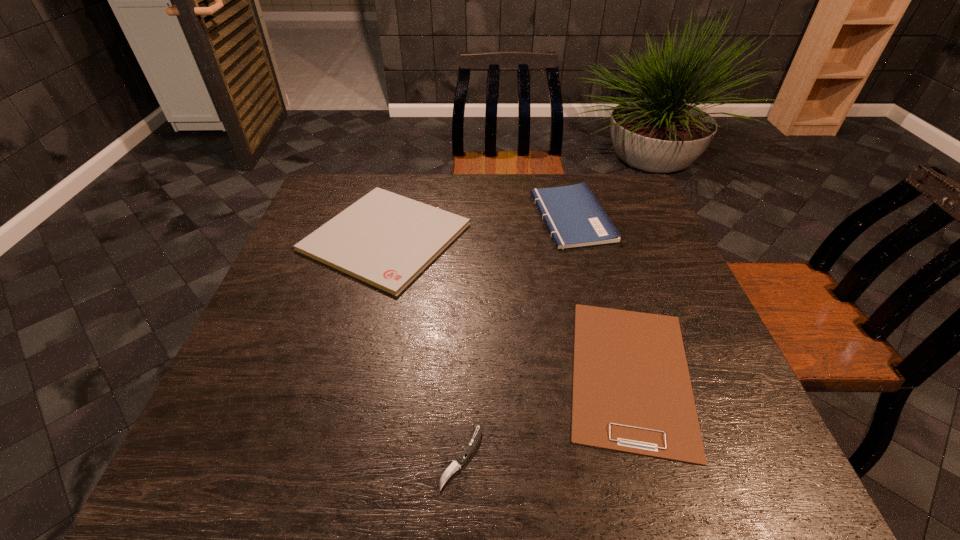
The image size is (960, 540). I want to click on paperback book that is positioned at the far edge, so click(574, 217).

The image size is (960, 540). Find the location of `clipboard that is at the far edge`. clipboard that is at the far edge is located at coordinates (384, 239).

You are a GUI agent. You are given a task and a screenshot of the screen. Output one action in this format:
    pyautogui.click(x=<x>, y=<y>)
    Task: Click on the clipboard that is positioned at the near edge
    
    Given the screenshot: What is the action you would take?
    pyautogui.click(x=632, y=393)

Find the location of `pocketknife positioned at the near edge`. pocketknife positioned at the near edge is located at coordinates (471, 445).

In order to click on object present at the left edge in this screenshot , I will do `click(384, 239)`.

Locate an element on the screen. This screenshot has height=540, width=960. paperback book at the right edge is located at coordinates (574, 217).

The width and height of the screenshot is (960, 540). What are the coordinates of `clipboard situated at the right edge` in the screenshot? It's located at (632, 393).

Identify the location of object that is at the far left corner. The height and width of the screenshot is (540, 960). (384, 239).

This screenshot has width=960, height=540. I want to click on object located at the far right corner, so click(574, 217).

The image size is (960, 540). In order to click on object located at the near right corner in this screenshot , I will do `click(632, 393)`.